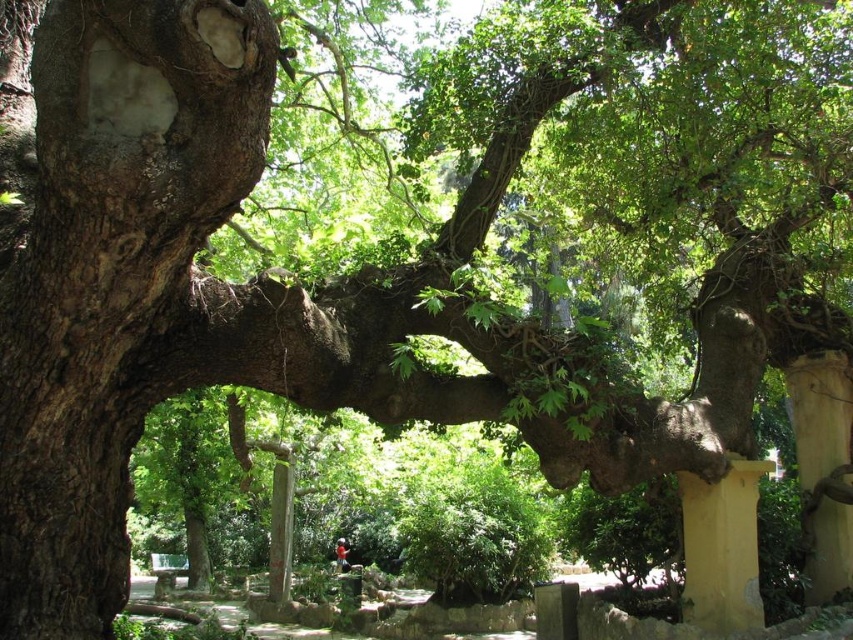
Is point (747, 496) behind point (837, 442)?

No, it is not.

Can you confirm if yellow painted stone pillar at lower right is thinner than yellow painted stone pillar at right?

No, yellow painted stone pillar at lower right is not thinner than yellow painted stone pillar at right.

Image resolution: width=853 pixels, height=640 pixels. What do you see at coordinates (722, 547) in the screenshot?
I see `yellow painted stone pillar at lower right` at bounding box center [722, 547].

Identify the location of yellow painted stone pillar at lower right. This screenshot has height=640, width=853. (722, 547).